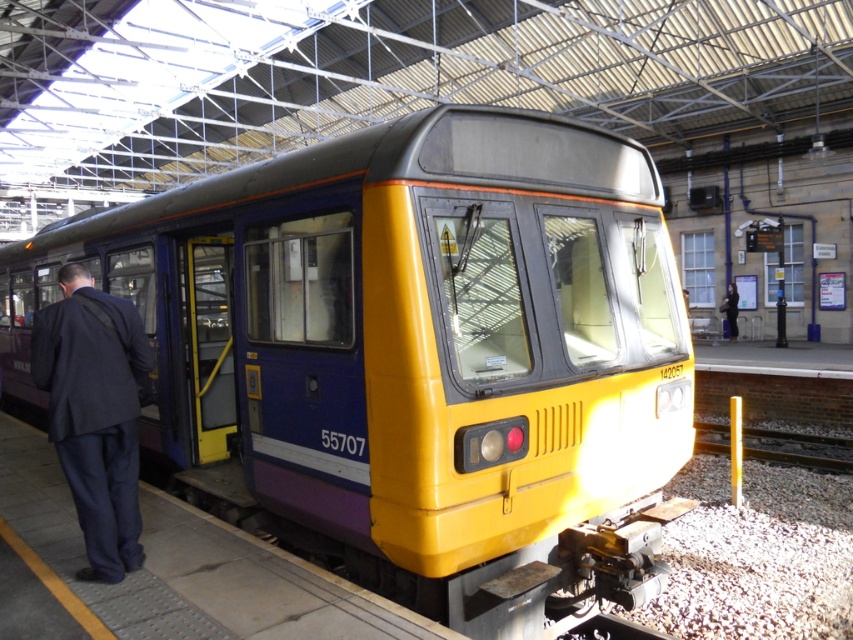
Is point (407, 454) positioned before point (844, 451)?

Yes, point (407, 454) is closer to viewer.

Can you confirm if yellow matte train at center is smaller than metallic gray train track at right?

Correct, yellow matte train at center occupies less space than metallic gray train track at right.

Is point (553, 291) positioned in front of point (849, 442)?

That is True.

In order to click on yellow matte train at center in this screenshot , I will do `click(410, 353)`.

Does dark blue suit at left come in front of metallic gray train track at right?

That is True.

Find the location of a particular element. dark blue suit at left is located at coordinates (96, 413).

Who is more distant from viewer, (x=634, y=224) or (x=102, y=417)?

The point (x=634, y=224) is behind.

Can you confirm if yellow matte train at center is smaller than dark blue suit at left?

Indeed, yellow matte train at center has a smaller size compared to dark blue suit at left.

This screenshot has height=640, width=853. Identify the location of yellow matte train at center. (410, 353).